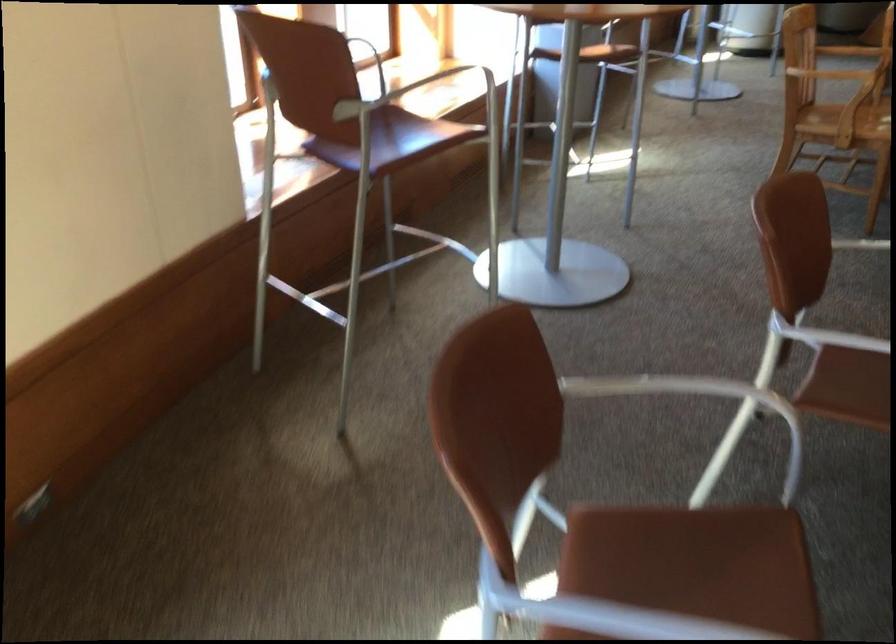
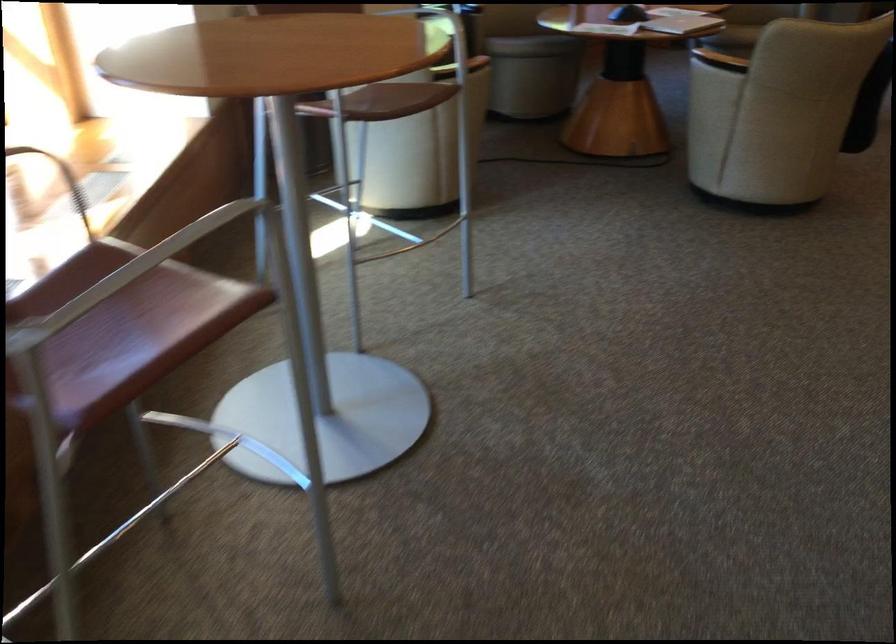
In a continuous first-person perspective shot, in which direction is the camera moving?

The cameraman moved toward right, forward.